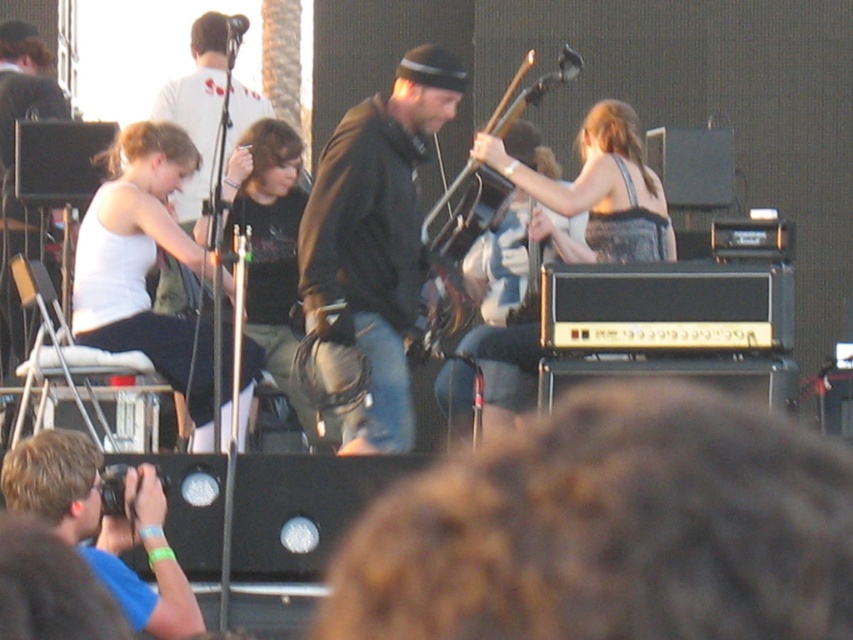
You are a photographer at the concert. You want to take a photo of the musician wearing the dark brown leather jacket at center and the metallic black guitar at center. Which object is positioned to the left of the other?

The dark brown leather jacket at center is to the left of the metallic black guitar at center.

You are a photographer standing at the back of the concert venue. You want to take a photo that includes both the dark brown leather jacket at center and the white fabric tank top at left. The minimum distance between these two items in your camera frame is 5 meters. Can you capture both in the same frame?

The dark brown leather jacket at center and white fabric tank top at left are 4.94 meters apart from each other. Since the minimum distance required is 5 meters, the photographer cannot capture both in the same frame as the actual distance is slightly less than required.

You are a photographer at the concert and want to capture both the white fabric tank top at left and the metallic black guitar at center in your photo. Which object will appear larger in your photo?

The white fabric tank top at left will appear larger in the photo because it is closer to the viewer than the metallic black guitar at center.